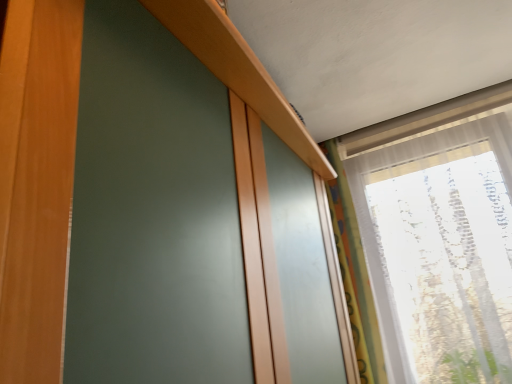
Question: Considering the positions of multicolored fabric curtain at right and transparent fabric at upper right in the image, is multicolored fabric curtain at right wider or thinner than transparent fabric at upper right?

Choices:
 (A) thin
 (B) wide

Answer: (A)

Question: Considering the positions of multicolored fabric curtain at right and transparent fabric at upper right in the image, is multicolored fabric curtain at right taller or shorter than transparent fabric at upper right?

Choices:
 (A) short
 (B) tall

Answer: (A)

Question: Is point (381, 372) closer or farther from the camera than point (461, 289)?

Choices:
 (A) farther
 (B) closer

Answer: (A)

Question: Is transparent fabric at upper right in front of or behind multicolored fabric curtain at right in the image?

Choices:
 (A) behind
 (B) front

Answer: (B)

Question: From the image's perspective, is transparent fabric at upper right above or below multicolored fabric curtain at right?

Choices:
 (A) below
 (B) above

Answer: (B)

Question: Is transparent fabric at upper right bigger or smaller than multicolored fabric curtain at right?

Choices:
 (A) big
 (B) small

Answer: (A)

Question: Choose the correct answer: Is transparent fabric at upper right inside multicolored fabric curtain at right or outside it?

Choices:
 (A) outside
 (B) inside

Answer: (A)